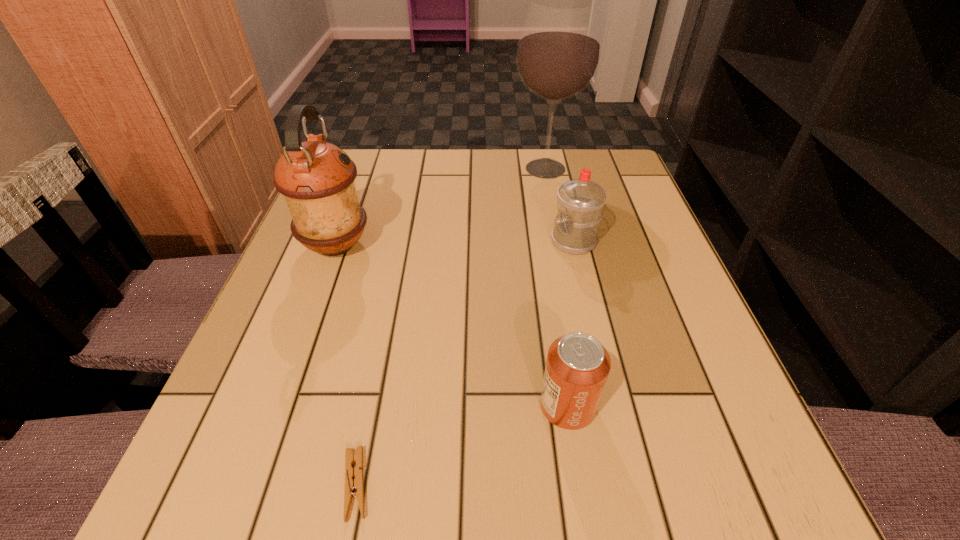
Find the location of a particular element. This screenshot has width=960, height=540. free space between the alcohol and the nearest object is located at coordinates (450, 327).

Where is `unoccupied position between the third tallest object and the clothespin`? Image resolution: width=960 pixels, height=540 pixels. unoccupied position between the third tallest object and the clothespin is located at coordinates (465, 363).

Locate an element on the screen. The width and height of the screenshot is (960, 540). free space between the oil lamp and the tallest object is located at coordinates (441, 207).

The height and width of the screenshot is (540, 960). I want to click on unoccupied area between the second shortest object and the nearest object, so click(x=461, y=446).

The width and height of the screenshot is (960, 540). Identify the location of empty space between the oil lamp and the farthest object. tap(441, 207).

Locate an element on the screen. The height and width of the screenshot is (540, 960). vacant area between the second tallest object and the clothespin is located at coordinates (346, 364).

Locate an element on the screen. This screenshot has width=960, height=540. vacant point located between the second shortest object and the fourth shortest object is located at coordinates (451, 326).

Identify the location of vacant point located between the water bottle and the oil lamp. (455, 243).

Locate which object ranks in proximity to the water bottle. Please provide its 2D coordinates. Your answer should be formatted as a tuple, i.e. [(x, y)], where the tuple contains the x and y coordinates of a point satisfying the conditions above.

[(559, 50)]

You are a GUI agent. You are given a task and a screenshot of the screen. Output one action in this format:
    pyautogui.click(x=<x>, y=<y>)
    Task: Click on the closest object to the can
    
    Given the screenshot: What is the action you would take?
    pyautogui.click(x=357, y=485)